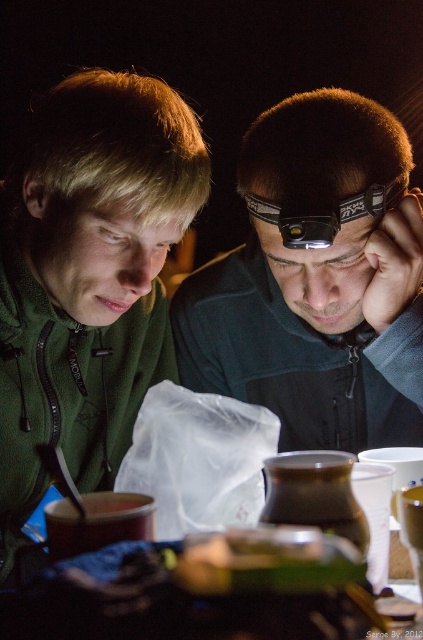
From the picture: Can you confirm if green matte hoodie at upper left is thinner than black plastic goggles at center?

No.

Is point (99, 246) farther from viewer compared to point (354, 200)?

Yes, it is.

At what (x,y) coordinates should I click in order to perform the action: click on green matte hoodie at upper left. Please return your answer as a coordinate pair (x, y). The width and height of the screenshot is (423, 640). Looking at the image, I should click on (87, 276).

Is green matte sandwich at center positioned before black plastic goggles at center?

Yes.

The image size is (423, 640). What are the coordinates of `green matte sandwich at center` in the screenshot? It's located at (266, 561).

Who is more forward, [354,548] or [301,227]?

Positioned in front is point [354,548].

In order to click on green matte sandwich at center in this screenshot , I will do `click(266, 561)`.

Is green matte hoodie at upper left thinner than green matte sandwich at center?

No, green matte hoodie at upper left is not thinner than green matte sandwich at center.

Can you confirm if green matte hoodie at upper left is positioned to the right of green matte sandwich at center?

No, green matte hoodie at upper left is not to the right of green matte sandwich at center.

Which is in front, point (66, 216) or point (269, 561)?

Positioned in front is point (269, 561).

This screenshot has width=423, height=640. I want to click on green matte hoodie at upper left, so click(87, 276).